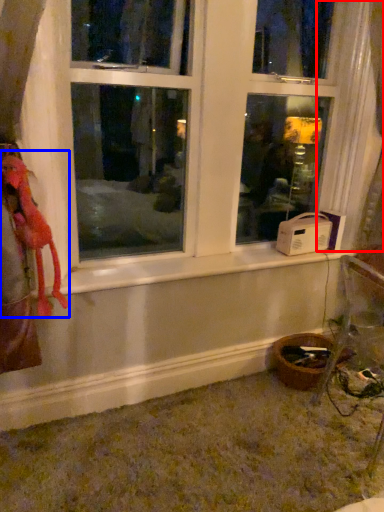
Question: Which point is further to the camera, curtain (highlighted by a red box) or animal (highlighted by a blue box)?

Choices:
 (A) curtain
 (B) animal

Answer: (A)